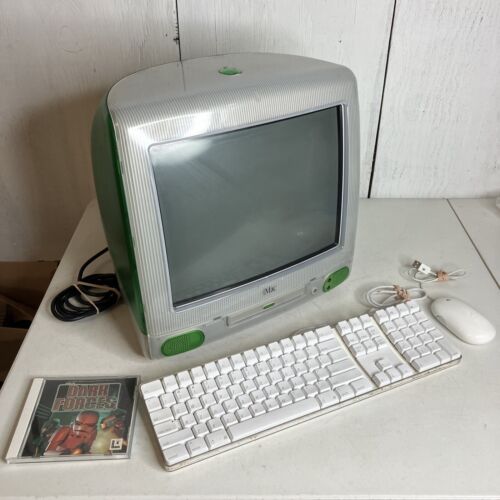
Locate an element on the screen. This screenshot has height=500, width=500. cable is located at coordinates (424, 276), (418, 290), (80, 309).